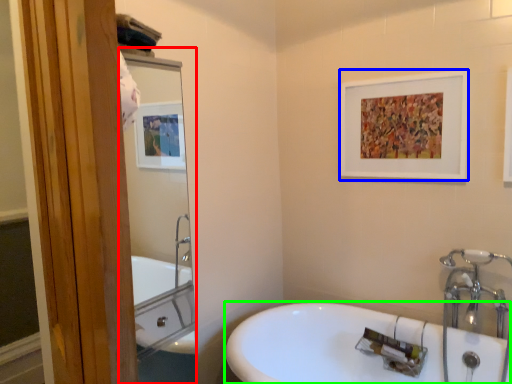
Question: Considering the real-world distances, which object is closest to mirror (highlighted by a red box)? picture frame (highlighted by a blue box) or sink (highlighted by a green box).

Choices:
 (A) picture frame
 (B) sink

Answer: (B)